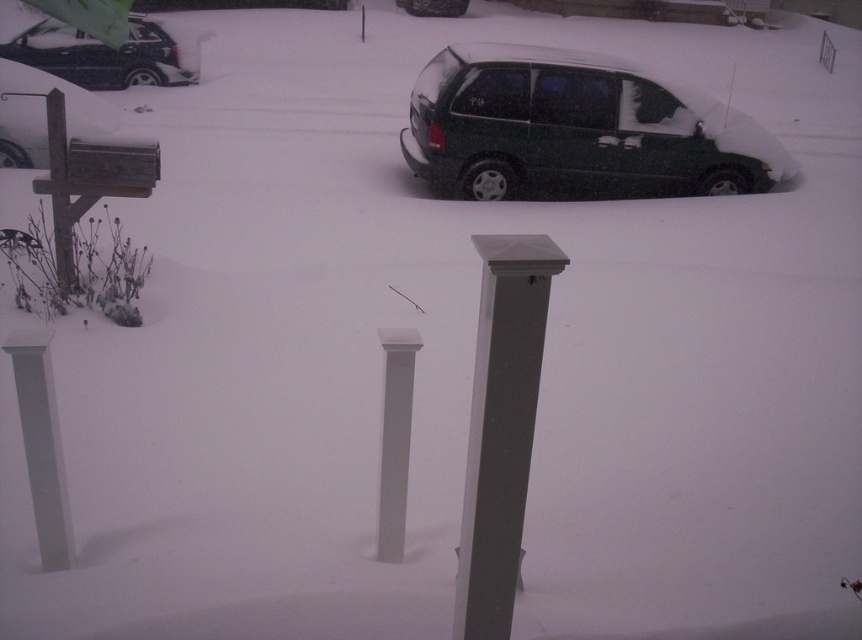
Question: Based on their relative distances, which object is nearer to the white smooth column at center?

Choices:
 (A) green matte minivan at upper right
 (B) white smooth post at left

Answer: (B)

Question: Does matte black car at upper left have a lesser width compared to white smooth column at center?

Choices:
 (A) yes
 (B) no

Answer: (B)

Question: Is white glossy column at center bigger than matte black car at upper left?

Choices:
 (A) yes
 (B) no

Answer: (B)

Question: Among these objects, which one is nearest to the camera?

Choices:
 (A) white smooth post at left
 (B) white glossy column at center
 (C) white smooth column at center

Answer: (B)

Question: Which point appears closest to the camera in this image?

Choices:
 (A) (128, 65)
 (B) (479, 596)
 (C) (39, 332)
 (D) (390, 426)

Answer: (B)

Question: Is white glossy column at center to the left of white smooth post at left from the viewer's perspective?

Choices:
 (A) no
 (B) yes

Answer: (A)